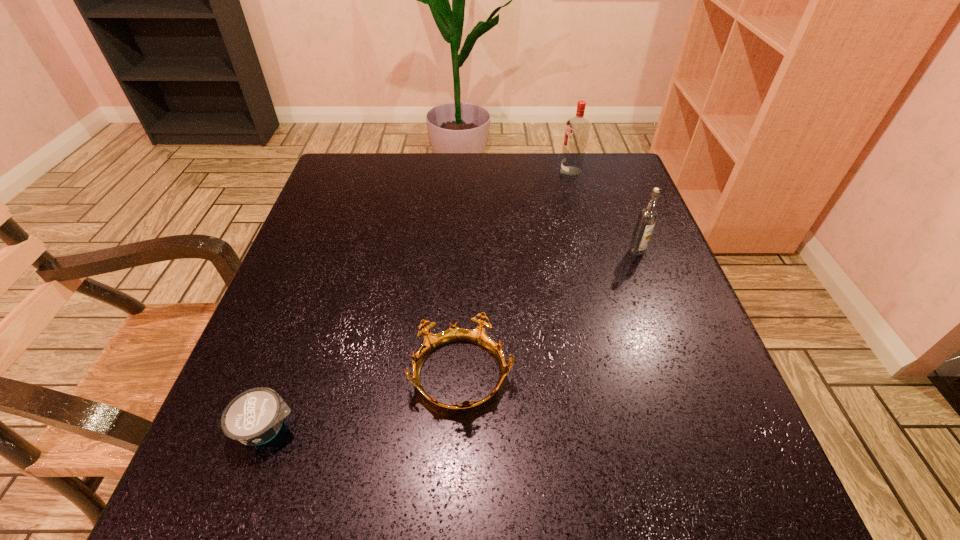
In order to click on free point between the second shortest object and the shortest object in this screenshot , I will do `click(365, 402)`.

At what (x,y) coordinates should I click in order to perform the action: click on free spot between the second object from left to right and the right vodka. Please return your answer as a coordinate pair (x, y). The image size is (960, 540). Looking at the image, I should click on (549, 314).

Locate an element on the screen. free space that is in between the shortest object and the left vodka is located at coordinates (420, 300).

Find the location of a particular element. Image resolution: width=960 pixels, height=540 pixels. free spot between the third object from right to left and the third object from left to right is located at coordinates (516, 274).

Find the location of a particular element. free space between the yogurt and the taller vodka is located at coordinates (420, 300).

Select which object appears as the closest to the farthest object. Please provide its 2D coordinates. Your answer should be formatted as a tuple, i.e. [(x, y)], where the tuple contains the x and y coordinates of a point satisfying the conditions above.

[(647, 217)]

Point out which object is positioned as the second nearest to the shortest object. Please provide its 2D coordinates. Your answer should be formatted as a tuple, i.e. [(x, y)], where the tuple contains the x and y coordinates of a point satisfying the conditions above.

[(647, 217)]

The image size is (960, 540). I want to click on free space that satisfies the following two spatial constraints: 1. on the back side of the third object from right to left; 2. on the right side of the leftmost object, so click(x=286, y=376).

Image resolution: width=960 pixels, height=540 pixels. What are the coordinates of `vacant space that satisfies the following two spatial constraints: 1. on the front label of the left vodka; 2. on the front side of the second shortest object` in the screenshot? It's located at (626, 376).

Find the location of a particular element. The height and width of the screenshot is (540, 960). free space that satisfies the following two spatial constraints: 1. on the front label of the taller vodka; 2. on the front side of the third object from right to left is located at coordinates (626, 376).